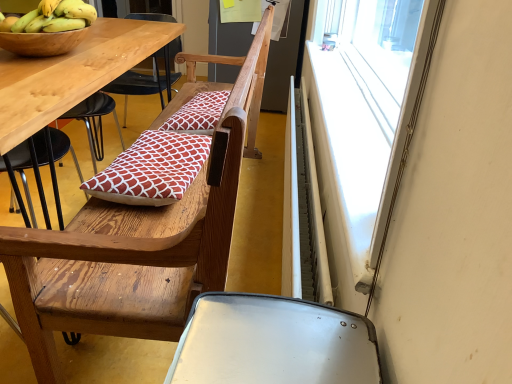
Image resolution: width=512 pixels, height=384 pixels. Describe the element at coordinates (52, 17) in the screenshot. I see `yellow matte bananas at upper left` at that location.

I want to click on red printed cushion at center, which is the first pillow in back-to-front order, so click(198, 113).

You are a GUI agent. You are given a task and a screenshot of the screen. Output one action in this format:
    pyautogui.click(x=<x>, y=<y>)
    Task: Click on the white plastic window at upper right
    The width and height of the screenshot is (512, 384).
    Given the screenshot: What is the action you would take?
    pyautogui.click(x=366, y=120)

Image resolution: width=512 pixels, height=384 pixels. I want to click on wooden chair at center, so click(x=137, y=242).

Measure the distance between white metallic radiator at right and camera.

white metallic radiator at right is 33.58 inches from camera.

Identify the location of yellow matte bananas at upper left. (52, 17).

Which is closer to the camera, (168, 294) or (142, 196)?

The point (168, 294) is in front.

Looking at this image, is wooden chair at center looking in the opposite direction of red printed cushion at center, which appears as the 2th pillow when viewed from the back?

Correct, wooden chair at center is looking away from red printed cushion at center, which appears as the 2th pillow when viewed from the back.

Measure the distance between wooden chair at center and red printed cushion at center, the 2th pillow when ordered from top to bottom.

wooden chair at center is 6.54 inches away from red printed cushion at center, the 2th pillow when ordered from top to bottom.

From a real-world perspective, between wooden chair at center and red printed cushion at center, positioned as the first pillow in bottom-to-top order, who is vertically higher?

red printed cushion at center, positioned as the first pillow in bottom-to-top order, from a real-world perspective.

From the image's perspective, is wooden chair at center above or below white metallic radiator at right?

wooden chair at center is above white metallic radiator at right.

Can we say wooden chair at center lies outside white metallic radiator at right?

Yes, wooden chair at center is outside of white metallic radiator at right.

From a real-world perspective, is wooden chair at center positioned above or below white metallic radiator at right?

wooden chair at center is situated higher than white metallic radiator at right in the real world.

Which of these two, wooden chair at center or white metallic radiator at right, is bigger?

wooden chair at center is bigger.

Is white metallic radiator at right directly adjacent to red printed cushion at center, which appears as the 2th pillow when viewed from the back?

No, white metallic radiator at right is not next to red printed cushion at center, which appears as the 2th pillow when viewed from the back.

From a real-world perspective, who is located lower, white metallic radiator at right or red printed cushion at center, positioned as the first pillow in bottom-to-top order?

white metallic radiator at right is physically lower.

From the image's perspective, does white metallic radiator at right appear higher than red printed cushion at center, which appears as the 2th pillow when viewed from the back?

Actually, white metallic radiator at right appears below red printed cushion at center, which appears as the 2th pillow when viewed from the back, in the image.

From a real-world perspective, is white plastic window at upper right physically below wooden chair at center?

No, from a real-world perspective, white plastic window at upper right is not under wooden chair at center.

Are white plastic window at upper right and wooden chair at center located far from each other?

No.

Which is in front, white plastic window at upper right or wooden chair at center?

white plastic window at upper right is closer to the camera.

Could yellow matte bananas at upper left be considered to be inside white metallic radiator at right?

No, yellow matte bananas at upper left is not surrounded by white metallic radiator at right.

In terms of height, does white metallic radiator at right look taller or shorter compared to yellow matte bananas at upper left?

Considering their sizes, white metallic radiator at right has more height than yellow matte bananas at upper left.

Considering the sizes of white metallic radiator at right and yellow matte bananas at upper left in the image, is white metallic radiator at right wider or thinner than yellow matte bananas at upper left?

white metallic radiator at right is thinner than yellow matte bananas at upper left.

From the image's perspective, between white metallic radiator at right and yellow matte bananas at upper left, which one is located above?

yellow matte bananas at upper left appears higher in the image.

Which is more to the right, yellow matte bananas at upper left or white plastic window at upper right?

white plastic window at upper right is more to the right.

How different are the orientations of yellow matte bananas at upper left and white plastic window at upper right in degrees?

yellow matte bananas at upper left and white plastic window at upper right are facing 86.4 degrees away from each other.

Which object is wider, yellow matte bananas at upper left or white plastic window at upper right?

Wider between the two is yellow matte bananas at upper left.

From their relative heights in the image, would you say yellow matte bananas at upper left is taller or shorter than red printed cushion at center, the 1th pillow in the front-to-back sequence?

Considering their sizes, yellow matte bananas at upper left has more height than red printed cushion at center, the 1th pillow in the front-to-back sequence.

How much distance is there between yellow matte bananas at upper left and red printed cushion at center, which appears as the 2th pillow when viewed from the back?

yellow matte bananas at upper left is 19.73 inches away from red printed cushion at center, which appears as the 2th pillow when viewed from the back.

Between yellow matte bananas at upper left and red printed cushion at center, positioned as the first pillow in bottom-to-top order, which one is positioned behind?

A: red printed cushion at center, positioned as the first pillow in bottom-to-top order.

Could you tell me if yellow matte bananas at upper left is turned towards red printed cushion at center, the 2th pillow when ordered from top to bottom?

No, yellow matte bananas at upper left is not facing towards red printed cushion at center, the 2th pillow when ordered from top to bottom.

At what (x,y) coordinates should I click in order to perform the action: click on pillow that appears below the wooden chair at center (from the image's perspective). Please return your answer as a coordinate pair (x, y). The width and height of the screenshot is (512, 384). Looking at the image, I should click on (152, 169).

Identify the location of chair above the white metallic radiator at right (from the image's perspective). (137, 242).

Considering their positions, is white plastic window at upper right positioned further to white metallic radiator at right than yellow matte bananas at upper left?

yellow matte bananas at upper left lies further to white metallic radiator at right than the other object.

Looking at the image, which one is located closer to wooden chair at center, white plastic window at upper right or white metallic radiator at right?

white metallic radiator at right.

From the image, which object appears to be farther from white metallic radiator at right, red printed cushion at center, positioned as the first pillow in bottom-to-top order, or wooden chair at center?

wooden chair at center.

Which object lies further to the anchor point red printed cushion at center, which is the first pillow in back-to-front order, red printed cushion at center, positioned as the first pillow in bottom-to-top order, or white metallic radiator at right?

white metallic radiator at right is positioned further to the anchor red printed cushion at center, which is the first pillow in back-to-front order.

Estimate the real-world distances between objects in this image. Which object is closer to yellow matte bananas at upper left, white plastic window at upper right or white metallic radiator at right?

Based on the image, white metallic radiator at right appears to be nearer to yellow matte bananas at upper left.

Consider the image. Considering their positions, is white metallic radiator at right positioned closer to red printed cushion at center, which is the first pillow in back-to-front order, than red printed cushion at center, the 1th pillow in the front-to-back sequence?

red printed cushion at center, the 1th pillow in the front-to-back sequence.

Based on their spatial positions, is yellow matte bananas at upper left or white metallic radiator at right further from white plastic window at upper right?

yellow matte bananas at upper left is further to white plastic window at upper right.

Based on their spatial positions, is white plastic window at upper right or white metallic radiator at right further from red printed cushion at center, which is counted as the second pillow, starting from the front?

white plastic window at upper right.

What are the coordinates of `chair between yellow matte bananas at upper left and white metallic radiator at right` in the screenshot? It's located at (137, 242).

Locate an element on the screen. radiator positioned between wooden chair at center and red printed cushion at center, the 1th pillow viewed from the top, from near to far is located at coordinates (302, 209).

In order to click on pillow between yellow matte bananas at upper left and red printed cushion at center, which appears as the 2th pillow when ordered from the bottom, along the z-axis in this screenshot , I will do `click(152, 169)`.

Find the location of a particular element. The image size is (512, 384). pillow between wooden chair at center and red printed cushion at center, the 1th pillow viewed from the top, in the front-back direction is located at coordinates (152, 169).